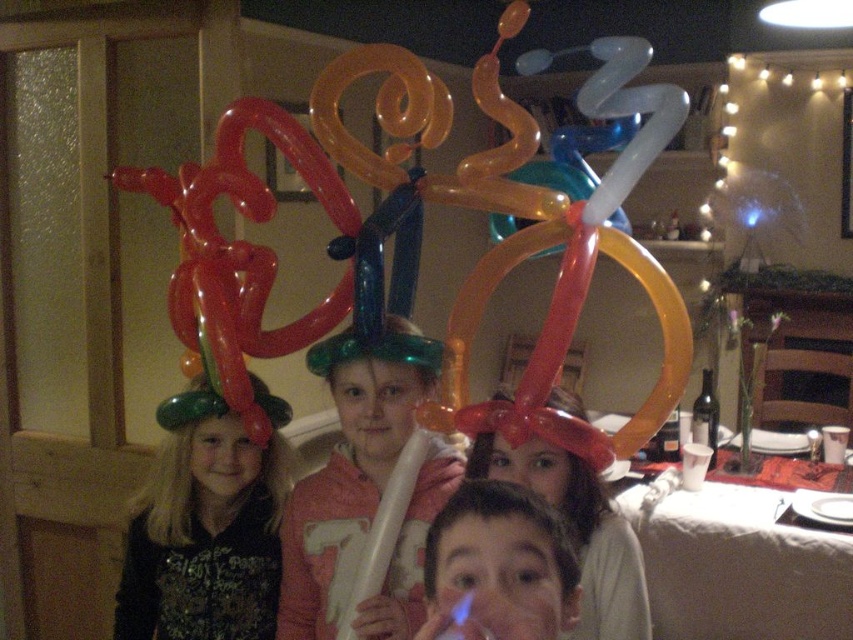
You are a photographer setting up for a group photo. You need to ensure that the green matte balloon hat at upper left and the matte balloon hat at center are both visible in the frame. Given their heights, which hat might block the view of the other?

The green matte balloon hat at upper left is taller than the matte balloon hat at center, so it might block the view of the matte balloon hat at center.

You are standing at the center of the room and want to reach the two points marked in the image. Which point, point (x=206, y=604) or point (x=587, y=513), is closer to you?

Point (x=587, y=513) is closer to you because it is in front of point (x=206, y=604).